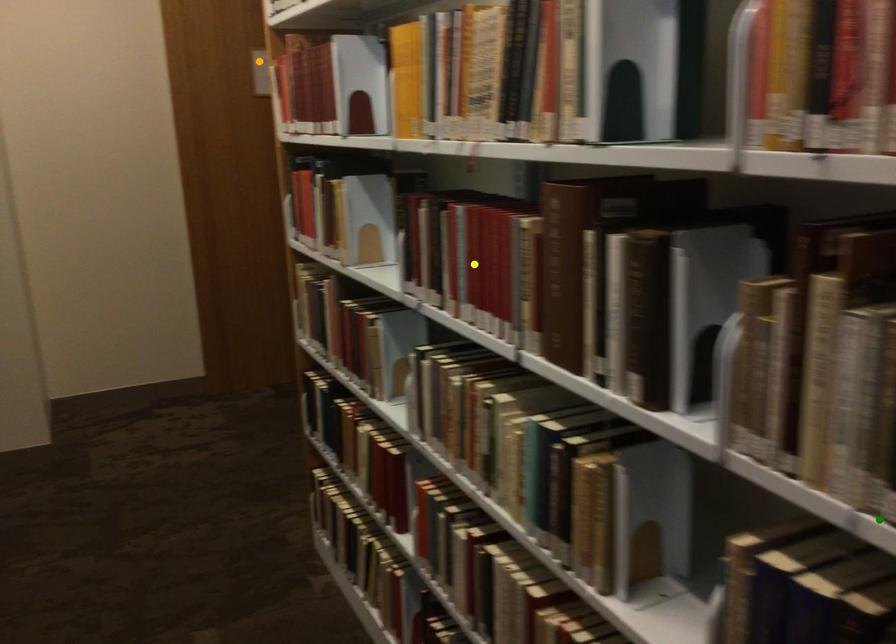
Based on the photo, order these from nearest to farthest:
A) orange point
B) green point
C) yellow point

green point, yellow point, orange point